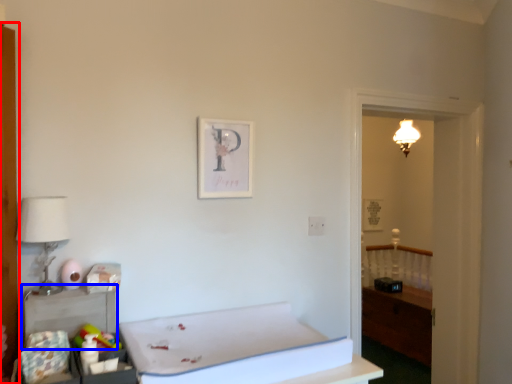
Question: Which point is closer to the camera, armoire (highlighted by a red box) or table (highlighted by a blue box)?

Choices:
 (A) armoire
 (B) table

Answer: (B)